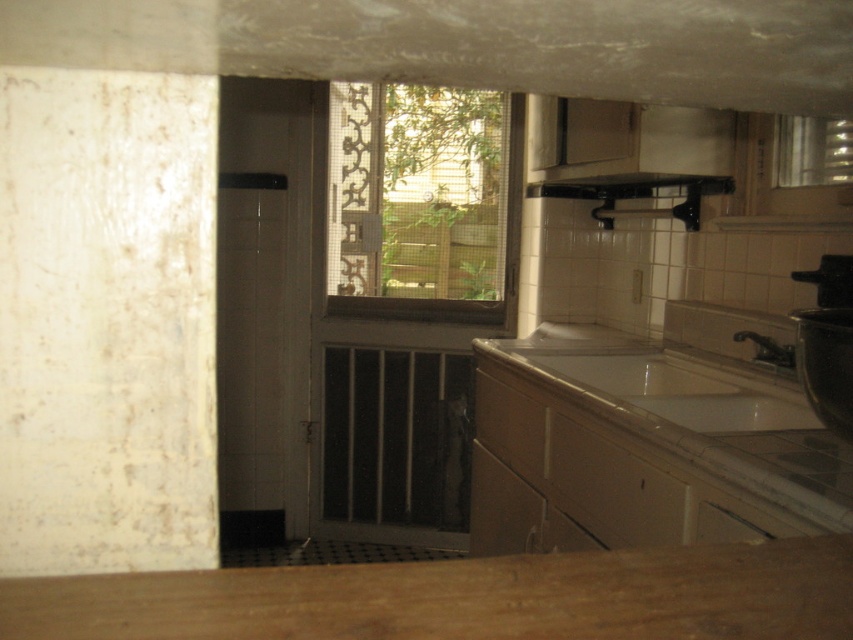
Question: Does black matte exhaust hood at upper center appear on the left side of clear glass window at upper right?

Choices:
 (A) yes
 (B) no

Answer: (A)

Question: Is black matte exhaust hood at upper center below white glossy sink at lower right?

Choices:
 (A) yes
 (B) no

Answer: (B)

Question: Which of the following is the closest to the observer?

Choices:
 (A) (724, 390)
 (B) (788, 358)

Answer: (B)

Question: Which object is closer to the camera taking this photo?

Choices:
 (A) black matte exhaust hood at upper center
 (B) matte silver faucet at lower right

Answer: (B)

Question: Which object is the farthest from the white glossy sink at lower right?

Choices:
 (A) clear glass window at upper right
 (B) black matte exhaust hood at upper center
 (C) clear glass window at center

Answer: (C)

Question: Is clear glass window at upper right smaller than matte silver faucet at lower right?

Choices:
 (A) yes
 (B) no

Answer: (B)